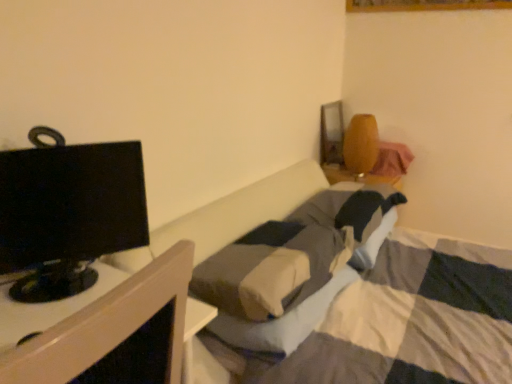
Question: Considering the positions of black glossy monitor at left and black glossy monitor at left in the image, is black glossy monitor at left wider or thinner than black glossy monitor at left?

Choices:
 (A) wide
 (B) thin

Answer: (A)

Question: From a real-world perspective, is black glossy monitor at left physically located above or below black glossy monitor at left?

Choices:
 (A) below
 (B) above

Answer: (A)

Question: Considering the positions of black glossy monitor at left and black glossy monitor at left in the image, is black glossy monitor at left taller or shorter than black glossy monitor at left?

Choices:
 (A) short
 (B) tall

Answer: (A)

Question: In terms of height, does black glossy monitor at left look taller or shorter compared to black glossy monitor at left?

Choices:
 (A) short
 (B) tall

Answer: (B)

Question: From the image's perspective, relative to black glossy monitor at left, is black glossy monitor at left above or below?

Choices:
 (A) below
 (B) above

Answer: (B)

Question: Considering the positions of black glossy monitor at left and black glossy monitor at left in the image, is black glossy monitor at left wider or thinner than black glossy monitor at left?

Choices:
 (A) wide
 (B) thin

Answer: (B)

Question: Does point (3, 251) appear closer or farther from the camera than point (37, 352)?

Choices:
 (A) farther
 (B) closer

Answer: (A)